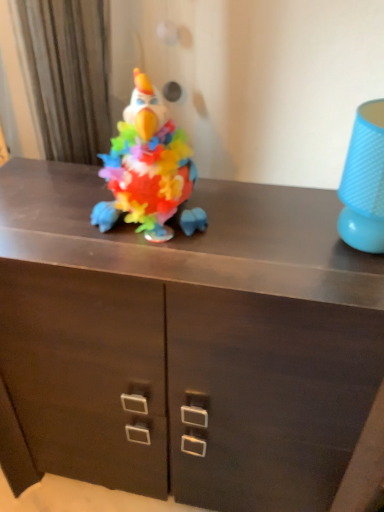
Question: Is blue textured lampshade at right smaller than plush multicolored parrot at center?

Choices:
 (A) no
 (B) yes

Answer: (B)

Question: Is blue textured lampshade at right outside of plush multicolored parrot at center?

Choices:
 (A) no
 (B) yes

Answer: (B)

Question: Is blue textured lampshade at right looking in the opposite direction of plush multicolored parrot at center?

Choices:
 (A) no
 (B) yes

Answer: (A)

Question: Does blue textured lampshade at right have a larger size compared to plush multicolored parrot at center?

Choices:
 (A) no
 (B) yes

Answer: (A)

Question: Does blue textured lampshade at right appear on the right side of plush multicolored parrot at center?

Choices:
 (A) no
 (B) yes

Answer: (B)

Question: Does blue textured lampshade at right have a lesser height compared to plush multicolored parrot at center?

Choices:
 (A) no
 (B) yes

Answer: (B)

Question: Considering the relative sizes of wooden cabinet at center and blue textured lampshade at right in the image provided, is wooden cabinet at center thinner than blue textured lampshade at right?

Choices:
 (A) no
 (B) yes

Answer: (A)

Question: From a real-world perspective, is wooden cabinet at center physically above blue textured lampshade at right?

Choices:
 (A) no
 (B) yes

Answer: (A)

Question: Is wooden cabinet at center outside blue textured lampshade at right?

Choices:
 (A) yes
 (B) no

Answer: (A)

Question: From the image's perspective, does wooden cabinet at center appear higher than blue textured lampshade at right?

Choices:
 (A) yes
 (B) no

Answer: (B)

Question: Is wooden cabinet at center shorter than blue textured lampshade at right?

Choices:
 (A) yes
 (B) no

Answer: (B)

Question: Is wooden cabinet at center in front of blue textured lampshade at right?

Choices:
 (A) no
 (B) yes

Answer: (A)

Question: Is plush multicolored parrot at center bigger than wooden cabinet at center?

Choices:
 (A) yes
 (B) no

Answer: (B)